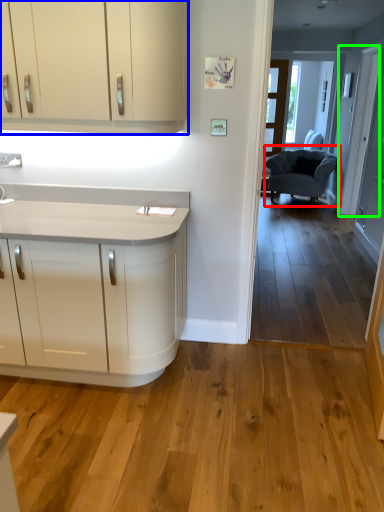
Question: Which is farther away from chair (highlighted by a red box)? cabinetry (highlighted by a blue box) or door (highlighted by a green box)?

Choices:
 (A) cabinetry
 (B) door

Answer: (A)